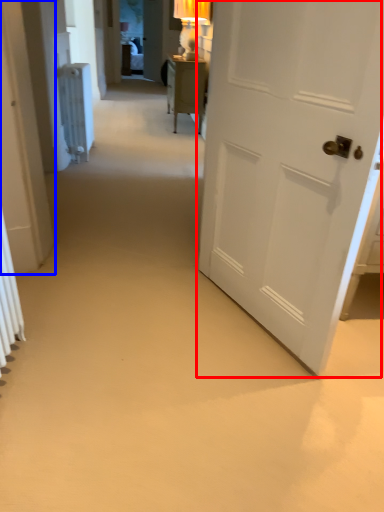
Question: Which object is closer to the camera taking this photo, door (highlighted by a red box) or door (highlighted by a blue box)?

Choices:
 (A) door
 (B) door

Answer: (A)